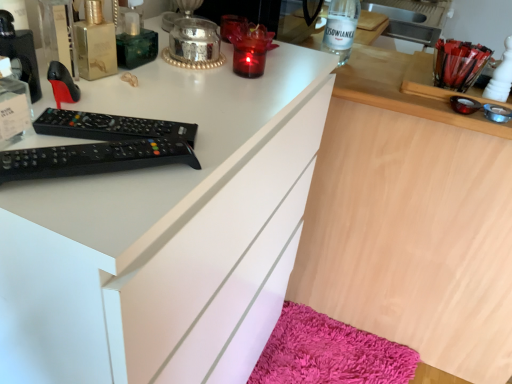
In order to click on vacant area that is situated to the right of clear glass bottle at upper center in this screenshot , I will do `click(386, 65)`.